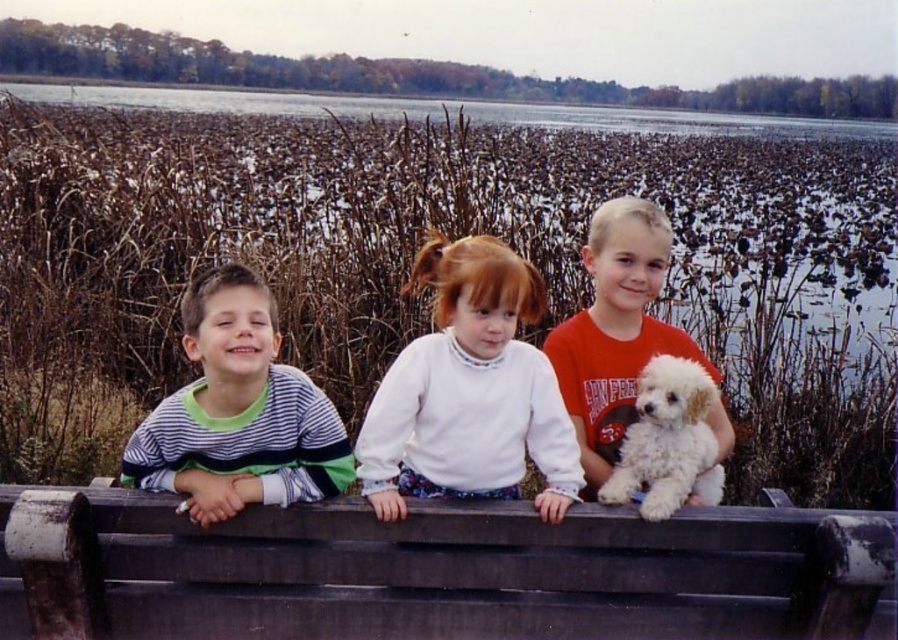
Does striped cotton shirt at left have a larger size compared to white fluffy dog at right?

No, striped cotton shirt at left is not bigger than white fluffy dog at right.

Which is above, striped cotton shirt at left or white fluffy dog at right?

Positioned higher is white fluffy dog at right.

Is point (213, 456) positioned after point (640, 358)?

No.

This screenshot has height=640, width=898. In order to click on striped cotton shirt at left in this screenshot , I will do `click(238, 412)`.

Can you confirm if brown grass at center is positioned to the right of clear water at upper center?

Incorrect, brown grass at center is not on the right side of clear water at upper center.

Is brown grass at center to the left of clear water at upper center from the viewer's perspective?

Yes, brown grass at center is to the left of clear water at upper center.

What are the coordinates of `brown grass at center` in the screenshot? It's located at (449, 237).

Is brown grass at center smaller than white fleece sweater at center?

No, brown grass at center is not smaller than white fleece sweater at center.

Is point (870, 499) in front of point (516, 474)?

No, it is behind (516, 474).

Locate an element on the screen. brown grass at center is located at coordinates (449, 237).

I want to click on brown grass at center, so click(x=449, y=237).